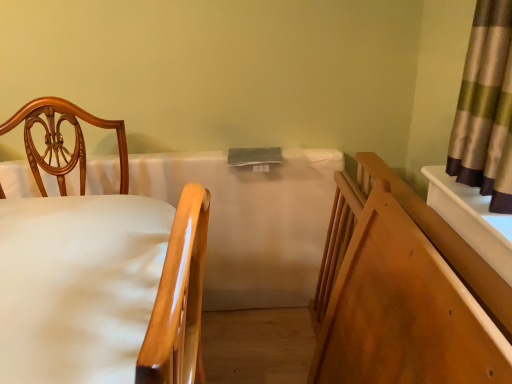
What is the approximate height of wooden chair at left?

The height of wooden chair at left is 24.02 inches.

What do you see at coordinates (407, 294) in the screenshot?
I see `wooden bed frame at right` at bounding box center [407, 294].

This screenshot has height=384, width=512. In order to click on wooden chair at left in this screenshot , I will do `click(178, 299)`.

How much distance is there between wooden chair at left and white fabric mattress at center?

They are 44.79 centimeters apart.

Looking at the image, does wooden chair at left seem bigger or smaller compared to white fabric mattress at center?

In the image, wooden chair at left appears to be smaller than white fabric mattress at center.

From a real-world perspective, which object rests below the other?

In real-world perspective, white fabric mattress at center is lower.

Does wooden chair at left lie behind white fabric mattress at center?

No, wooden chair at left is closer to the camera.

Can you confirm if wooden chair at left is thinner than wooden bed frame at right?

No.

Is wooden bed frame at right a part of wooden chair at left?

No, wooden chair at left does not contain wooden bed frame at right.

Could you tell me if wooden chair at left is facing wooden bed frame at right?

No, wooden chair at left is not facing towards wooden bed frame at right.

Would you say white fabric mattress at center is a long distance from wooden chair at left?

No, white fabric mattress at center is not far away from wooden chair at left.

Is white fabric mattress at center spatially inside wooden chair at left, or outside of it?

The correct answer is: outside.

Is the position of white fabric mattress at center less distant than that of wooden chair at left?

No, it is behind wooden chair at left.

Which is more to the left, white fabric mattress at center or wooden chair at left?

From the viewer's perspective, white fabric mattress at center appears more on the left side.

Would you say wooden bed frame at right is inside or outside wooden chair at left?

wooden bed frame at right exists outside the volume of wooden chair at left.

Is wooden bed frame at right facing towards wooden chair at left?

Yes, wooden bed frame at right faces towards wooden chair at left.

Which object is closer to the camera taking this photo, wooden bed frame at right or wooden chair at left?

wooden chair at left is more forward.

From a real-world perspective, relative to wooden chair at left, is wooden bed frame at right vertically above or below?

wooden bed frame at right is situated lower than wooden chair at left in the real world.

How many degrees apart are the facing directions of white fabric mattress at center and wooden bed frame at right?

They differ by 90 degrees in their facing directions.

Is white fabric mattress at center positioned with its back to wooden bed frame at right?

No.

Consider the image. Does white fabric mattress at center appear on the left side of wooden bed frame at right?

Yes, white fabric mattress at center is to the left of wooden bed frame at right.

Is point (288, 265) positioned behind point (398, 262)?

That is True.

Which object is thinner, wooden bed frame at right or white fabric mattress at center?

white fabric mattress at center is thinner.

From the image's perspective, is wooden bed frame at right located above or below white fabric mattress at center?

Based on their image positions, wooden bed frame at right is located beneath white fabric mattress at center.

Considering the relative sizes of wooden bed frame at right and white fabric mattress at center in the image provided, is wooden bed frame at right smaller than white fabric mattress at center?

Indeed, wooden bed frame at right has a smaller size compared to white fabric mattress at center.

The image size is (512, 384). Identify the location of mattress below the wooden chair at left (from a real-world perspective). (252, 221).

Locate an element on the screen. bed frame below the wooden chair at left (from the image's perspective) is located at coordinates coord(407,294).

Considering their positions, is wooden bed frame at right positioned further to white fabric mattress at center than wooden chair at left?

Based on the image, wooden bed frame at right appears to be further to white fabric mattress at center.

In the scene shown: When comparing their distances from wooden chair at left, does white fabric mattress at center or wooden bed frame at right seem further?

Based on the image, wooden bed frame at right appears to be further to wooden chair at left.

From the image, which object appears to be farther from wooden bed frame at right, wooden chair at left or white fabric mattress at center?

wooden chair at left is further to wooden bed frame at right.

Based on their spatial positions, is white fabric mattress at center or wooden chair at left closer to wooden bed frame at right?

white fabric mattress at center is positioned closer to the anchor wooden bed frame at right.

Which object lies nearer to the anchor point wooden chair at left, wooden bed frame at right or white fabric mattress at center?

white fabric mattress at center lies closer to wooden chair at left than the other object.

Looking at the image, which one is located further to white fabric mattress at center, wooden chair at left or wooden bed frame at right?

Based on the image, wooden bed frame at right appears to be further to white fabric mattress at center.

Where is `bed frame between wooden chair at left and white fabric mattress at center along the z-axis`? The image size is (512, 384). bed frame between wooden chair at left and white fabric mattress at center along the z-axis is located at coordinates (407, 294).